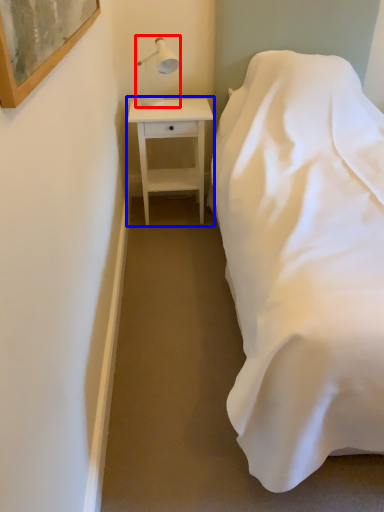
Question: Which object appears farthest to the camera in this image, table lamp (highlighted by a red box) or nightstand (highlighted by a blue box)?

Choices:
 (A) table lamp
 (B) nightstand

Answer: (B)